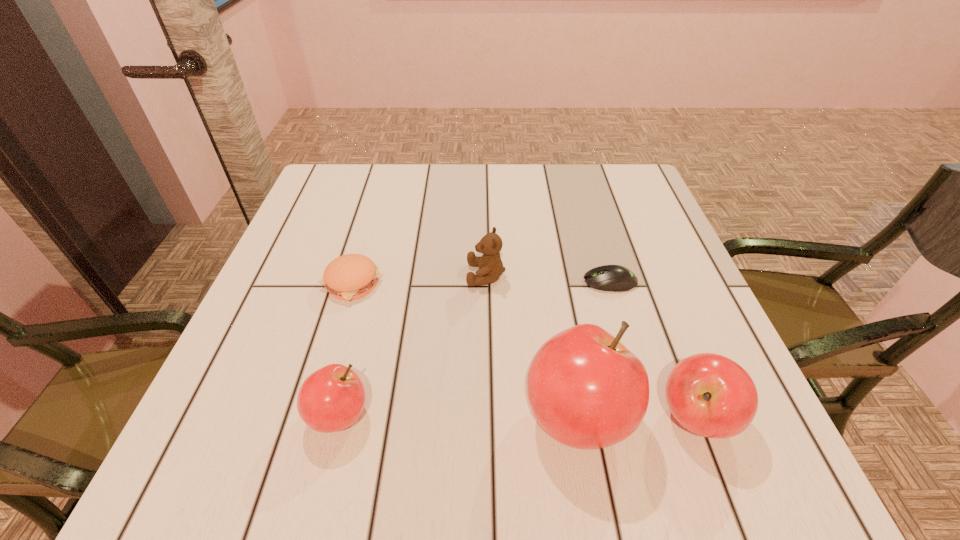
Find the location of `free area in between the teddy bear and the second shortest object`. free area in between the teddy bear and the second shortest object is located at coordinates (419, 279).

You are a GUI agent. You are given a task and a screenshot of the screen. Output one action in this format:
    pyautogui.click(x=<x>, y=<y>)
    Task: Click on the free space between the second apple from left to right and the leftmost apple
    This screenshot has width=960, height=540.
    Given the screenshot: What is the action you would take?
    pyautogui.click(x=458, y=416)

Image resolution: width=960 pixels, height=540 pixels. Find the location of `empty space between the patty and the shortest apple`. empty space between the patty and the shortest apple is located at coordinates (346, 349).

Where is `free space between the teddy bear and the shortest apple`? free space between the teddy bear and the shortest apple is located at coordinates pos(413,345).

Point out which object is positioned as the nearest to the rightmost apple. Please provide its 2D coordinates. Your answer should be formatted as a tuple, i.e. [(x, y)], where the tuple contains the x and y coordinates of a point satisfying the conditions above.

[(586, 390)]

Locate an element on the screen. object that stands as the second closest to the second apple from left to right is located at coordinates (614, 278).

Find the location of `the second closest apple to the patty`. the second closest apple to the patty is located at coordinates (586, 390).

Where is `apple that stands as the second closest to the tallest object`? The image size is (960, 540). apple that stands as the second closest to the tallest object is located at coordinates (332, 398).

Locate an element on the screen. The height and width of the screenshot is (540, 960). vacant space that satisfies the following two spatial constraints: 1. on the front-facing side of the tallest object; 2. on the right side of the fourth object from right to left is located at coordinates (488, 416).

At what (x,y) coordinates should I click in order to perform the action: click on free space that satisfies the following two spatial constraints: 1. on the front side of the second apple from left to right; 2. on the right side of the rightmost apple. Please return your answer as a coordinate pair (x, y). The width and height of the screenshot is (960, 540). Looking at the image, I should click on (577, 417).